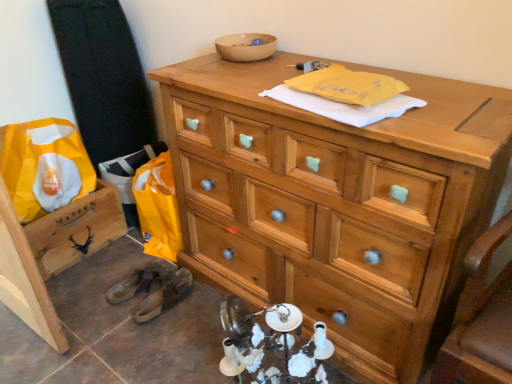
Where is `free space to the left of brown leather shoe at lower left, which is the 1th shoe in left-to-right order`? Image resolution: width=512 pixels, height=384 pixels. free space to the left of brown leather shoe at lower left, which is the 1th shoe in left-to-right order is located at coordinates pyautogui.click(x=97, y=283).